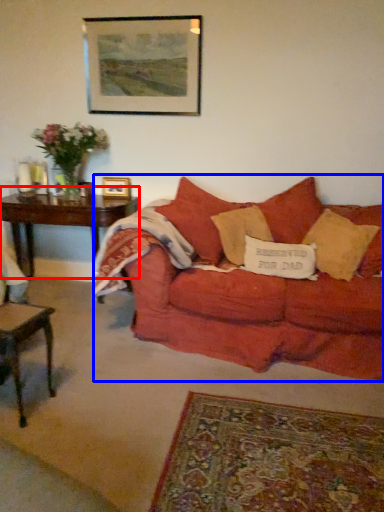
Question: Which object appears closest to the camera in this image, table (highlighted by a red box) or studio couch (highlighted by a blue box)?

Choices:
 (A) table
 (B) studio couch

Answer: (B)